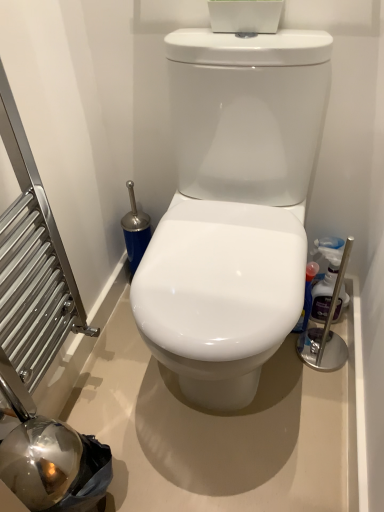
Question: From a real-world perspective, is white glossy toilet at center beneath glossy plastic spray bottle at right, the first cleaning product positioned from the left?

Choices:
 (A) yes
 (B) no

Answer: (B)

Question: Is white glossy toilet at center outside glossy plastic spray bottle at right, which appears as the second cleaning product when viewed from the right?

Choices:
 (A) no
 (B) yes

Answer: (B)

Question: From the image's perspective, is white glossy toilet at center under glossy plastic spray bottle at right, the first cleaning product positioned from the left?

Choices:
 (A) no
 (B) yes

Answer: (A)

Question: Is glossy plastic spray bottle at right, which appears as the second cleaning product when viewed from the right, surrounded by white glossy toilet at center?

Choices:
 (A) yes
 (B) no

Answer: (A)

Question: Is white glossy toilet at center next to glossy plastic spray bottle at right, the first cleaning product positioned from the left?

Choices:
 (A) yes
 (B) no

Answer: (B)

Question: Considering the relative sizes of white glossy toilet at center and glossy plastic spray bottle at right, the first cleaning product positioned from the left, in the image provided, is white glossy toilet at center bigger than glossy plastic spray bottle at right, the first cleaning product positioned from the left,?

Choices:
 (A) yes
 (B) no

Answer: (A)

Question: Is white glossy toilet at center shorter than translucent plastic bottle at right, the 1th cleaning product viewed from the right?

Choices:
 (A) no
 (B) yes

Answer: (A)

Question: Would you say white glossy toilet at center is outside translucent plastic bottle at right, the 1th cleaning product viewed from the right?

Choices:
 (A) yes
 (B) no

Answer: (A)

Question: Is white glossy toilet at center smaller than translucent plastic bottle at right, the 1th cleaning product viewed from the right?

Choices:
 (A) yes
 (B) no

Answer: (B)

Question: Are white glossy toilet at center and translucent plastic bottle at right, the 1th cleaning product viewed from the right, making contact?

Choices:
 (A) no
 (B) yes

Answer: (A)

Question: From the image's perspective, would you say white glossy toilet at center is positioned over translucent plastic bottle at right, the 2th cleaning product when ordered from left to right?

Choices:
 (A) no
 (B) yes

Answer: (B)

Question: Is white glossy toilet at center oriented towards translucent plastic bottle at right, the 2th cleaning product when ordered from left to right?

Choices:
 (A) yes
 (B) no

Answer: (B)

Question: Can you confirm if glossy plastic spray bottle at right, the first cleaning product positioned from the left, is thinner than translucent plastic bottle at right, the 2th cleaning product when ordered from left to right?

Choices:
 (A) no
 (B) yes

Answer: (A)